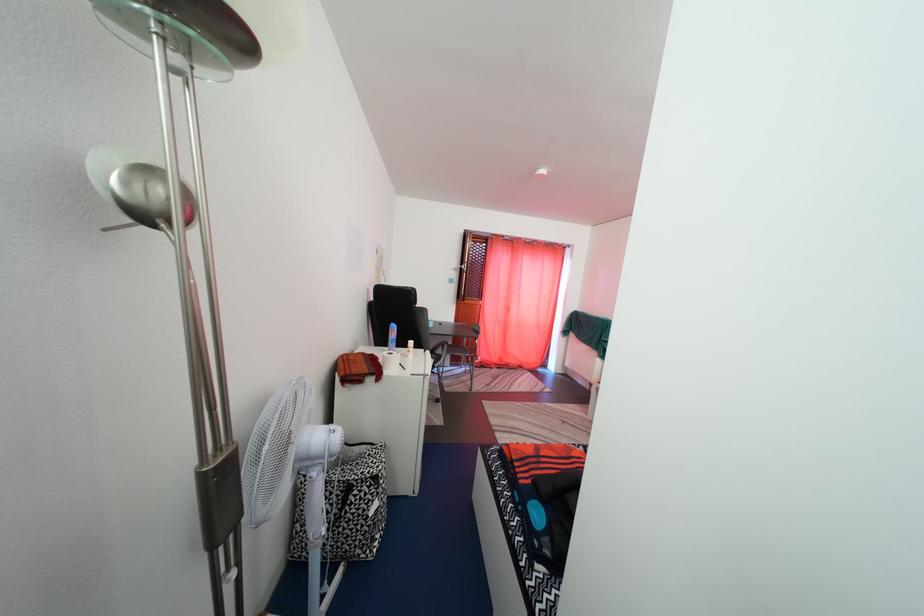
I want to click on chair sitting surface, so click(457, 354).